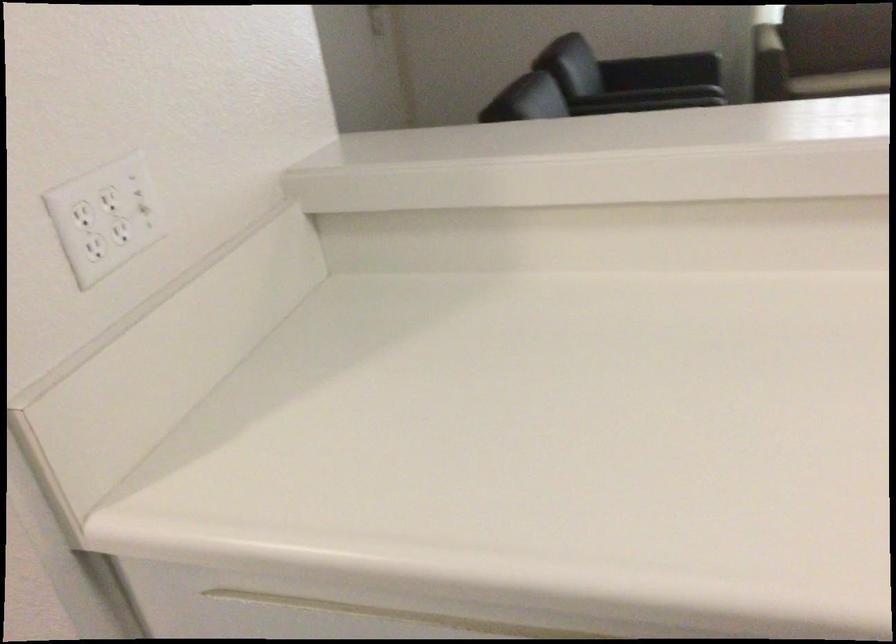
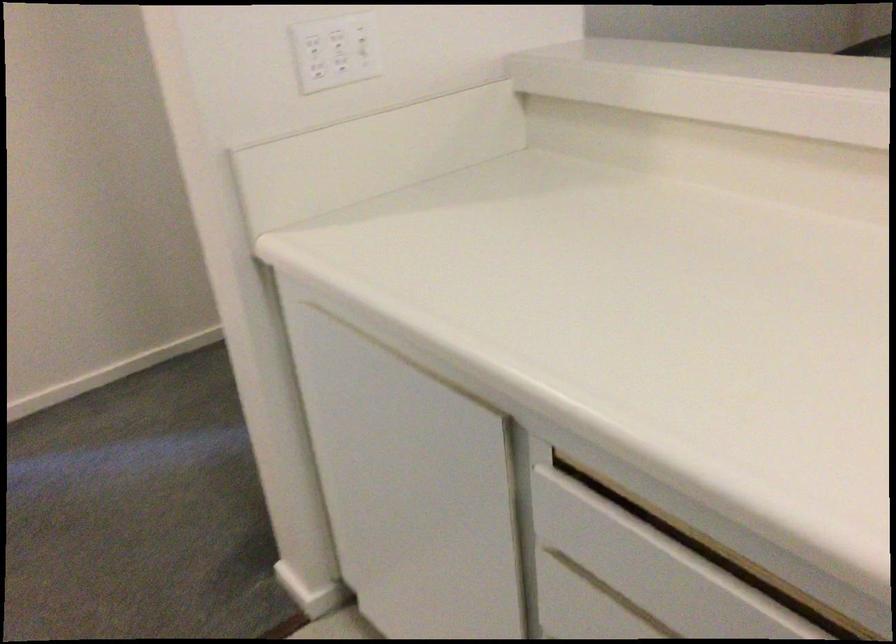
The point at (90, 259) is marked in the first image. Where is the corresponding point in the second image?

(312, 77)